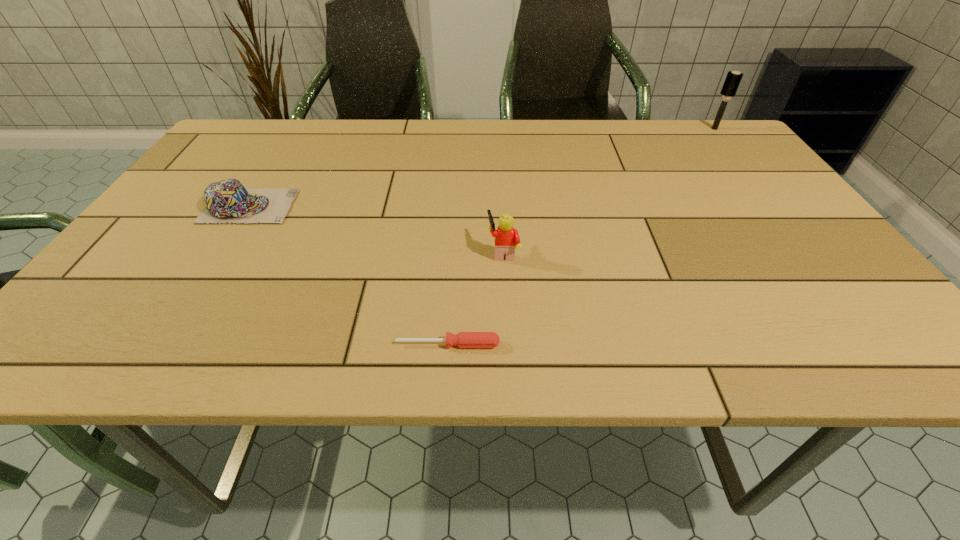
Where is `vacant position at the near edge of the desktop`? This screenshot has width=960, height=540. vacant position at the near edge of the desktop is located at coordinates click(514, 338).

Where is `blank space at the left edge of the desktop`? Image resolution: width=960 pixels, height=540 pixels. blank space at the left edge of the desktop is located at coordinates (174, 246).

The image size is (960, 540). What are the coordinates of `vacant space at the right edge of the desktop` in the screenshot? It's located at (776, 269).

The width and height of the screenshot is (960, 540). What are the coordinates of `vacant region at the far left corner of the desktop` in the screenshot? It's located at (280, 120).

Image resolution: width=960 pixels, height=540 pixels. In the image, there is a desktop. Find the location of `blank space at the far right corner`. blank space at the far right corner is located at coordinates (693, 140).

Locate an element on the screen. free space at the near right corner is located at coordinates (865, 362).

Identify the location of free spot between the rightmost object and the third farthest object. (609, 190).

Identify the location of free space between the cap and the screwdriver. This screenshot has height=540, width=960. (348, 275).

You are a GUI agent. You are given a task and a screenshot of the screen. Output one action in this format:
    pyautogui.click(x=<x>, y=<y>)
    Task: Click on the free spot between the screwdriver and the Lego
    Image resolution: width=960 pixels, height=540 pixels.
    Given the screenshot: What is the action you would take?
    coord(475,298)

Where is `vacant space that's between the rightmost object and the second tallest object`? Image resolution: width=960 pixels, height=540 pixels. vacant space that's between the rightmost object and the second tallest object is located at coordinates (609, 190).